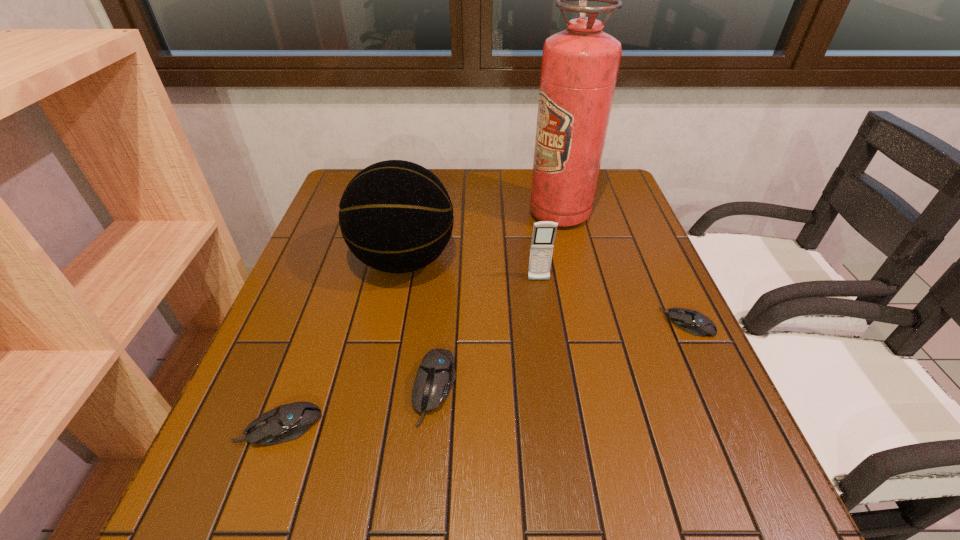
Where is `the second closest computer mouse to the second shortest computer mouse`? the second closest computer mouse to the second shortest computer mouse is located at coordinates (691, 321).

Locate which computer mouse is the closest to the fourth farthest object. Please provide its 2D coordinates. Your answer should be formatted as a tuple, i.e. [(x, y)], where the tuple contains the x and y coordinates of a point satisfying the conditions above.

[(435, 376)]

You are a GUI agent. You are given a task and a screenshot of the screen. Output one action in this format:
    pyautogui.click(x=<x>, y=<y>)
    Task: Click on the free space that satisfies the following two spatial constraints: 1. on the label side of the fire extinguisher; 2. on the front side of the fifth shortest object
    The width and height of the screenshot is (960, 540).
    Given the screenshot: What is the action you would take?
    pyautogui.click(x=570, y=260)

Identify the location of vacant position in the image that satisfies the following two spatial constraints: 1. on the back side of the second tallest computer mouse; 2. on the right side of the basketball. This screenshot has width=960, height=540. (341, 260).

Image resolution: width=960 pixels, height=540 pixels. Identify the location of vacant point that satisfies the following two spatial constraints: 1. on the label side of the fire extinguisher; 2. on the right side of the fourth farthest object. (586, 323).